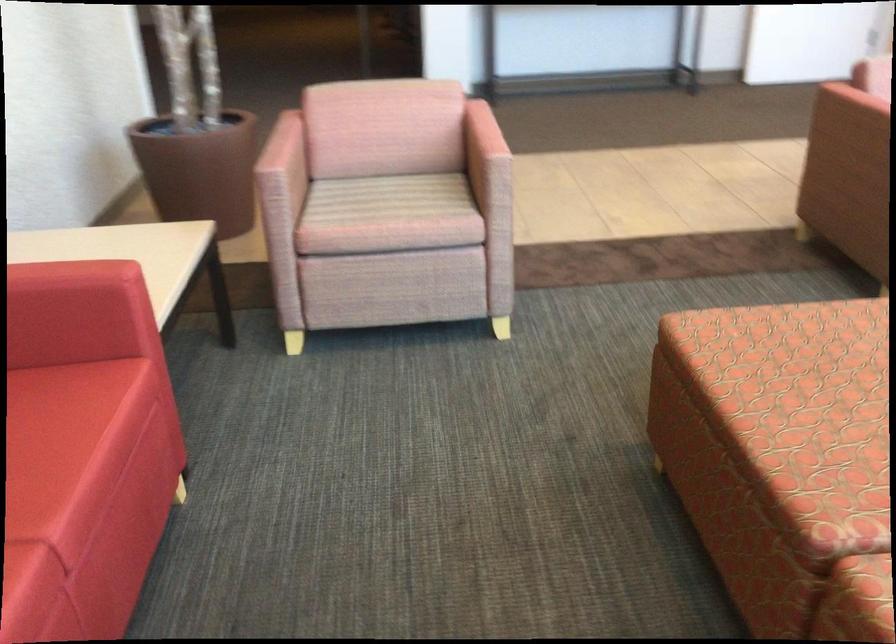
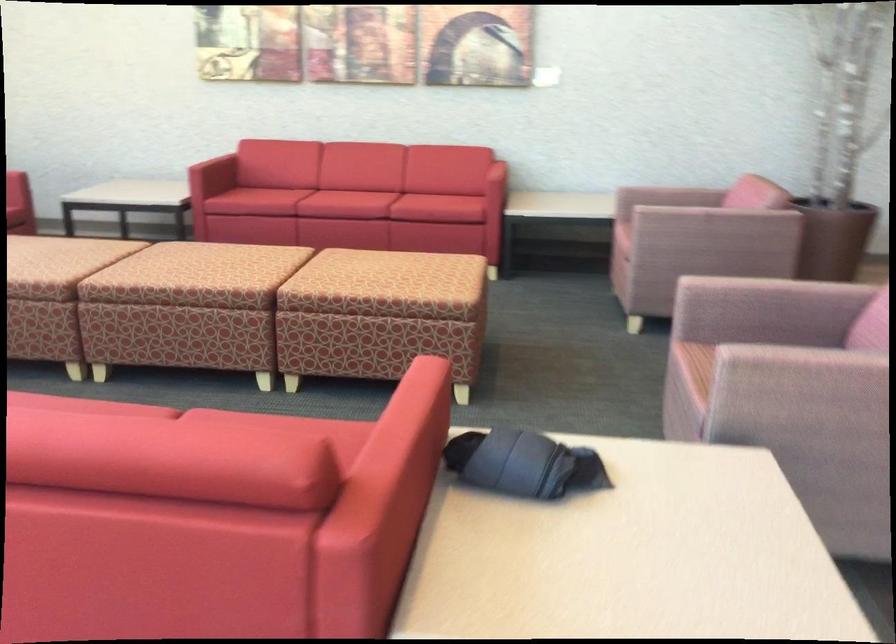
Question: I am providing you with two images of the same scene from different viewpoints. After the viewpoint changes to image2, which objects are now occluded?

Choices:
 (A) white disposable cup
 (B) pink chair sitting surface
 (C) red sofa sitting surface
 (D) red sofa armrest

Answer: (D)